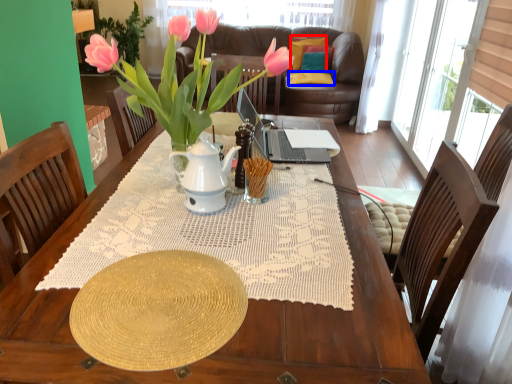
Question: Which of the following is the farthest to the observer, pillow (highlighted by a red box) or pillow (highlighted by a blue box)?

Choices:
 (A) pillow
 (B) pillow

Answer: (A)